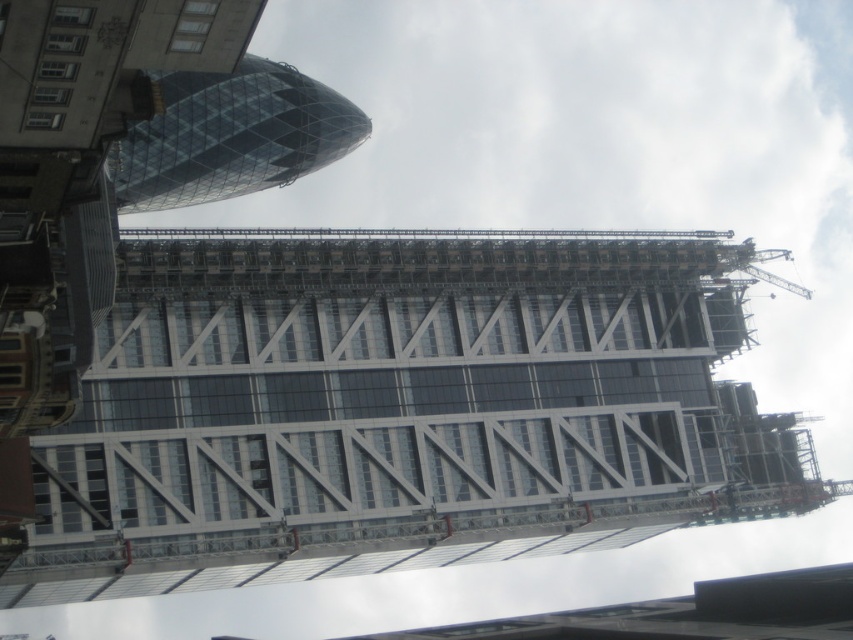
You are standing in the urban landscape and want to determine the relative positions of two points marked in the image. Which point, point (480, 282) or point (223, 182), is closer to you?

Point (480, 282) is closer to the viewer than point (223, 182).

You are an architect observing the urban landscape. You notice the transparent glass building at center and the transparent glass tower at upper left. Which of these two structures is located closer to the ground level?

The transparent glass building at center is positioned under the transparent glass tower at upper left, so it is closer to the ground level.